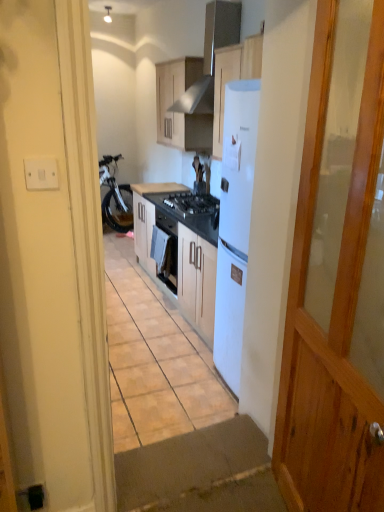
Question: Is matte wood cabinet at upper center, marked as the 1th cabinetry in a top-to-bottom arrangement, far from white plastic switch at left?

Choices:
 (A) yes
 (B) no

Answer: (A)

Question: Does matte wood cabinet at upper center, marked as the 1th cabinetry in a top-to-bottom arrangement, have a greater width compared to white plastic switch at left?

Choices:
 (A) no
 (B) yes

Answer: (B)

Question: Is matte wood cabinet at upper center, marked as the 1th cabinetry in a top-to-bottom arrangement, shorter than white plastic switch at left?

Choices:
 (A) no
 (B) yes

Answer: (A)

Question: Is white plastic switch at left at the back of matte wood cabinet at upper center, which is counted as the 2th cabinetry, starting from the bottom?

Choices:
 (A) yes
 (B) no

Answer: (B)

Question: From a real-world perspective, is matte wood cabinet at upper center, marked as the 1th cabinetry in a top-to-bottom arrangement, positioned under white plastic switch at left based on gravity?

Choices:
 (A) yes
 (B) no

Answer: (B)

Question: Is matte wood cabinet at upper center, which is counted as the 2th cabinetry, starting from the bottom, bigger than white plastic switch at left?

Choices:
 (A) no
 (B) yes

Answer: (B)

Question: Can we say white matte cabinet at center, marked as the 1th cabinetry in a bottom-to-top arrangement, lies outside black matte gas stove at center?

Choices:
 (A) no
 (B) yes

Answer: (B)

Question: Can you confirm if white matte cabinet at center, marked as the 1th cabinetry in a bottom-to-top arrangement, is positioned to the left of black matte gas stove at center?

Choices:
 (A) yes
 (B) no

Answer: (A)

Question: Are white matte cabinet at center, the second cabinetry viewed from the top, and black matte gas stove at center making contact?

Choices:
 (A) no
 (B) yes

Answer: (A)

Question: Does white matte cabinet at center, marked as the 1th cabinetry in a bottom-to-top arrangement, lie in front of black matte gas stove at center?

Choices:
 (A) no
 (B) yes

Answer: (A)

Question: Is white matte cabinet at center, marked as the 1th cabinetry in a bottom-to-top arrangement, facing towards black matte gas stove at center?

Choices:
 (A) yes
 (B) no

Answer: (B)

Question: Is white matte cabinet at center, the second cabinetry viewed from the top, positioned with its back to black matte gas stove at center?

Choices:
 (A) no
 (B) yes

Answer: (A)

Question: Does white plastic switch at left have a greater width compared to black matte gas stove at center?

Choices:
 (A) no
 (B) yes

Answer: (A)